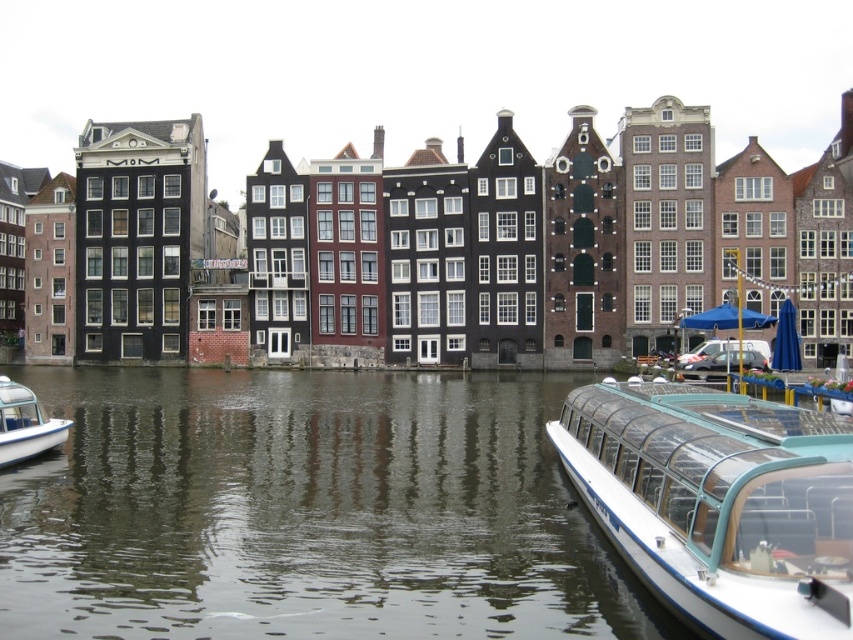
Question: Among these objects, which one is farthest from the camera?

Choices:
 (A) white glossy boat at lower left
 (B) white glossy boat at lower right

Answer: (A)

Question: Is smooth water at center wider than white glossy boat at lower left?

Choices:
 (A) no
 (B) yes

Answer: (B)

Question: Does smooth water at center appear under white glossy boat at lower left?

Choices:
 (A) yes
 (B) no

Answer: (A)

Question: Which of these objects is positioned farthest from the white glossy boat at lower left?

Choices:
 (A) smooth water at center
 (B) white glossy boat at lower right

Answer: (B)

Question: Which of the following is the closest to the observer?

Choices:
 (A) white glossy boat at lower left
 (B) smooth water at center
 (C) white glossy boat at lower right

Answer: (C)

Question: Does white glossy boat at lower right have a larger size compared to white glossy boat at lower left?

Choices:
 (A) yes
 (B) no

Answer: (A)